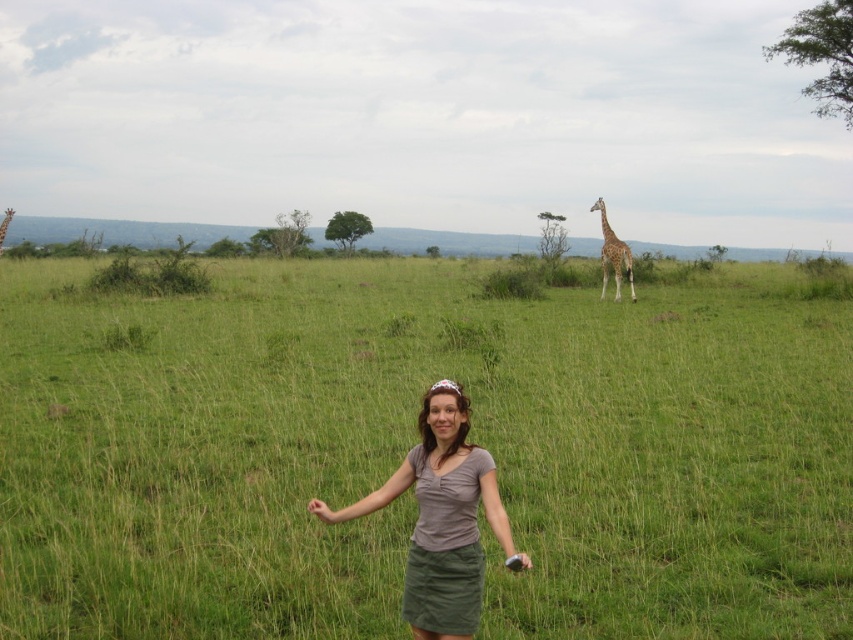
You are a photographer trying to capture the woman in the gray shirt at center. The camera is set to focus on the point at coordinates point [440,518]. Will the camera focus on the correct subject?

Yes, the camera will focus on the correct subject because the point [440,518] marks the matte gray shirt at center.

You are a photographer planning to take a picture of the green grassy field at center and the spotted fur giraffe at right. Which object should you focus on first if you want to capture both in a single frame, considering their sizes?

The green grassy field at center is larger in size than the spotted fur giraffe at right, so you should focus on the green grassy field at center first to ensure it fills the frame appropriately before adjusting for the smaller giraffe.

You are a photographer trying to capture the woman in the gray top and green skirt standing in the savanna. The scene is at point (415, 444). Where should you position your camera to ensure the woman is centered in the frame?

The green grassy field at center is located at point (415, 444), so positioning the camera at that coordinate will center the woman in the frame.